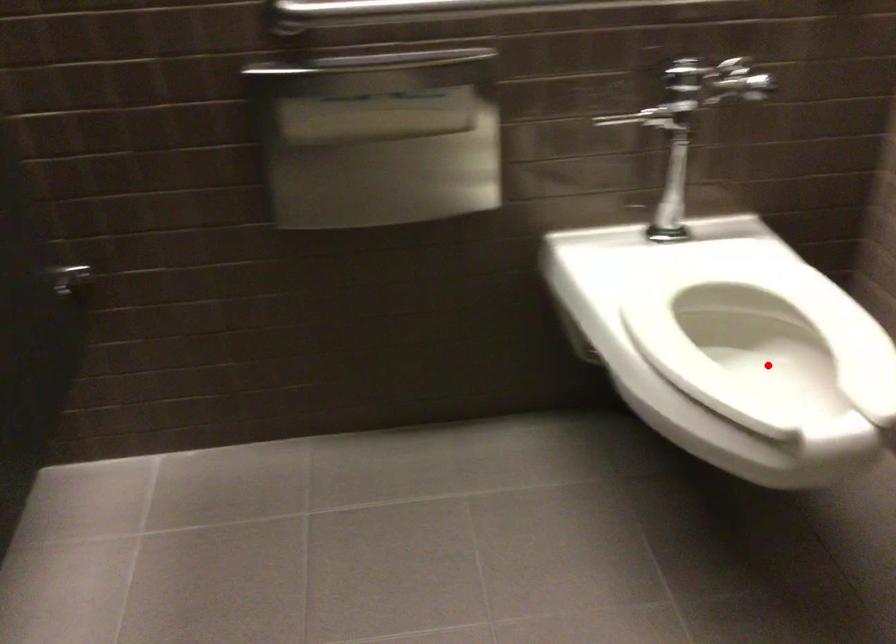
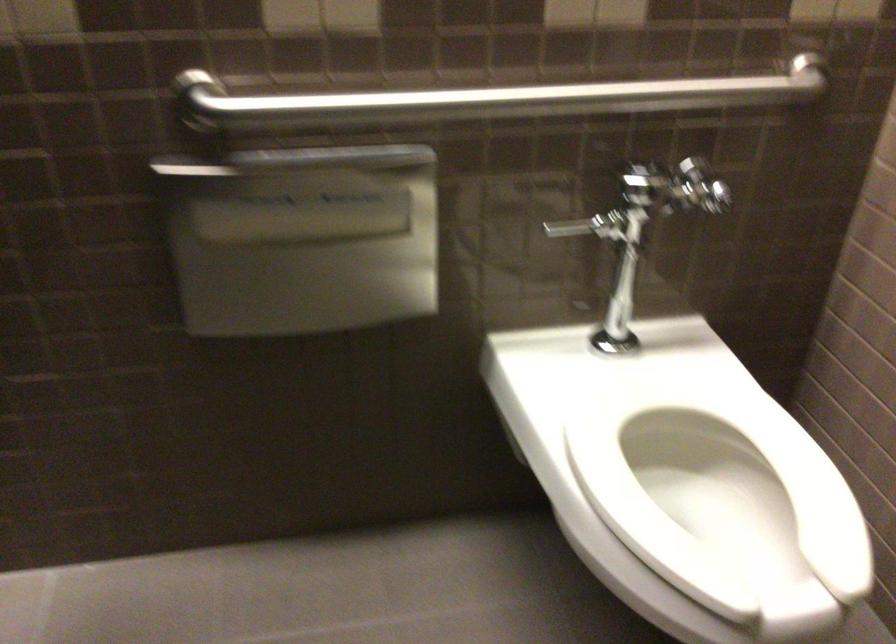
The point at the highlighted location is marked in the first image. Where is the corresponding point in the second image?

(719, 494)